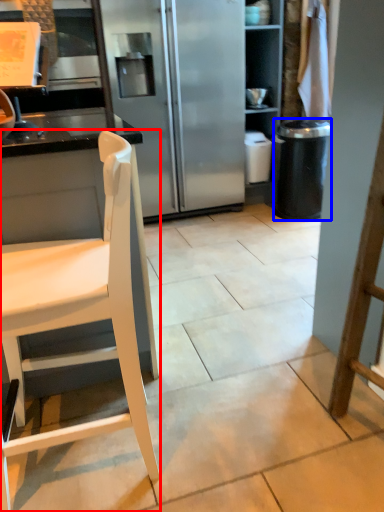
Question: Among these objects, which one is nearest to the camera, chair (highlighted by a red box) or trash bin/can (highlighted by a blue box)?

Choices:
 (A) chair
 (B) trash bin/can

Answer: (A)